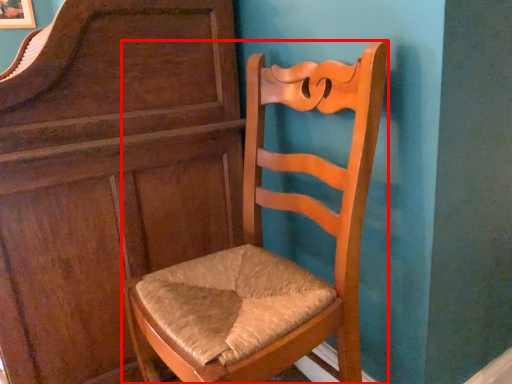
Question: From the image's perspective, what is the correct spatial positioning of chair (annotated by the red box) in reference to dresser?

Choices:
 (A) below
 (B) above

Answer: (A)